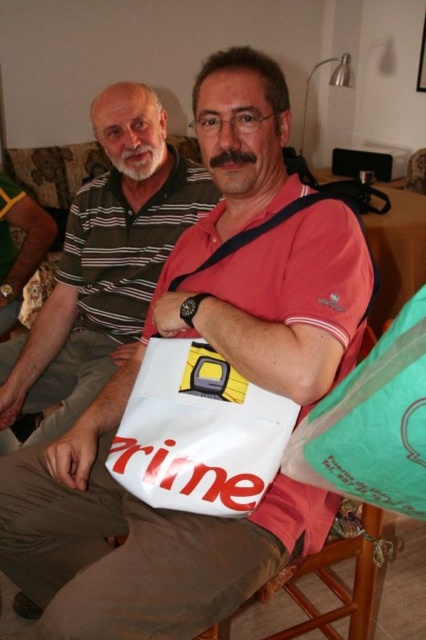
You are organizing a charity event and need to place two white matte bags in a specific order. The scene shows a white matte bag at center and a white matte tote at center. According to the image, which one should be placed first if you are arranging them from top to bottom?

The white matte bag at center should be placed first since it is located above the white matte tote at center in the image.

You are standing in the living room and see two points marked in the image. Which point is closer to you, point (x=126, y=177) or point (x=271, y=449)?

Point (x=126, y=177) is closer to you than point (x=271, y=449).

You are organizing a storage space and need to place the green plastic bag at lower right and the wooden chair at lower center. Which object should you place first if you want to prioritize placing larger items first?

The wooden chair at lower center should be placed first because it is larger than the green plastic bag at lower right.